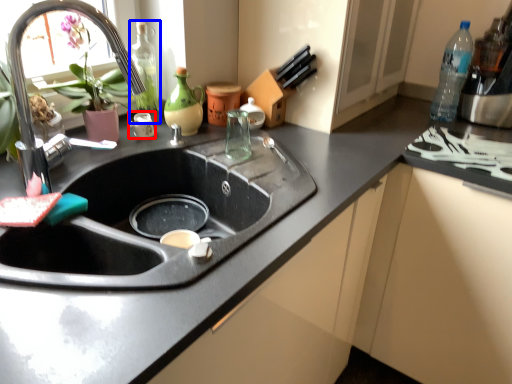
Question: Which object appears farthest to the camera in this image, appliance (highlighted by a red box) or bottle (highlighted by a blue box)?

Choices:
 (A) appliance
 (B) bottle

Answer: (A)